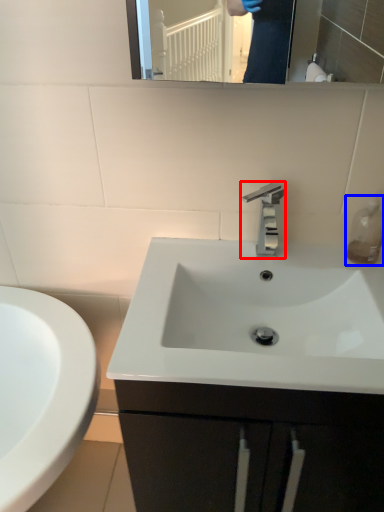
Question: Among these objects, which one is farthest to the camera, tap (highlighted by a red box) or soap dispenser (highlighted by a blue box)?

Choices:
 (A) tap
 (B) soap dispenser

Answer: (B)